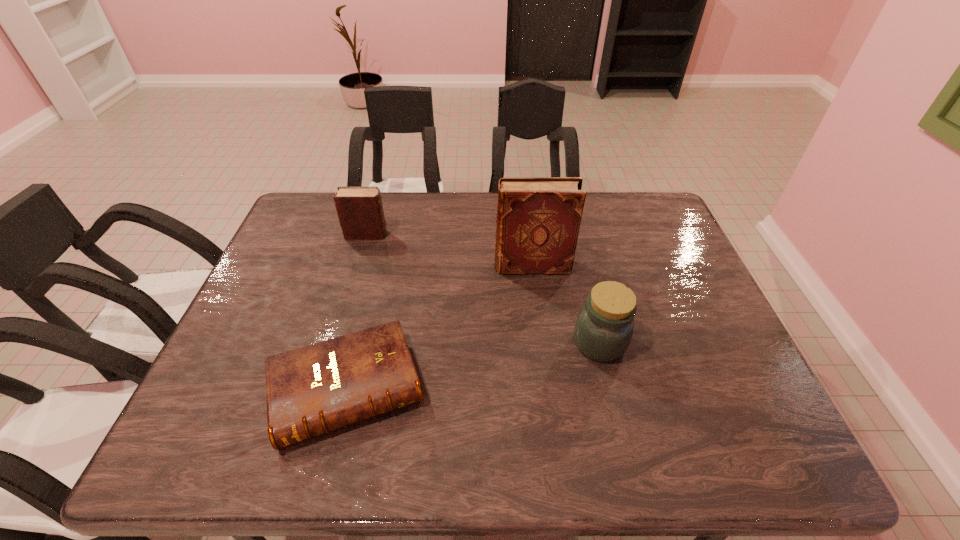
At what (x,y) coordinates should I click in order to perform the action: click on free space between the farthest object and the tallest object. Please return your answer as a coordinate pair (x, y). Looking at the image, I should click on (449, 251).

Find the location of `vacant space in between the jar and the shorter hardback book`. vacant space in between the jar and the shorter hardback book is located at coordinates (473, 366).

The image size is (960, 540). What are the coordinates of `object that stands as the third closest to the diary` in the screenshot? It's located at (604, 327).

Select which object is the closest to the shorter hardback book. Please provide its 2D coordinates. Your answer should be formatted as a tuple, i.e. [(x, y)], where the tuple contains the x and y coordinates of a point satisfying the conditions above.

[(538, 219)]

Where is `vacant area in the image that satisfies the following two spatial constraints: 1. on the back side of the left hardback book; 2. on the spine side of the diary`? The width and height of the screenshot is (960, 540). vacant area in the image that satisfies the following two spatial constraints: 1. on the back side of the left hardback book; 2. on the spine side of the diary is located at coordinates (385, 234).

Locate an element on the screen. The image size is (960, 540). vacant area in the image that satisfies the following two spatial constraints: 1. on the spine side of the farther hardback book; 2. on the front side of the nearer hardback book is located at coordinates (547, 389).

The width and height of the screenshot is (960, 540). I want to click on blank space that satisfies the following two spatial constraints: 1. on the spine side of the shortest object; 2. on the left side of the farthest object, so click(x=322, y=389).

This screenshot has width=960, height=540. What are the coordinates of `vacant space that satisfies the following two spatial constraints: 1. on the spine side of the jar; 2. on the right side of the right hardback book` in the screenshot? It's located at (541, 343).

The image size is (960, 540). I want to click on blank area in the image that satisfies the following two spatial constraints: 1. on the spine side of the farthest object; 2. on the right side of the shorter hardback book, so click(322, 389).

In order to click on vacant space that satisfies the following two spatial constraints: 1. on the spine side of the left hardback book; 2. on the right side of the diary in this screenshot , I will do `click(322, 389)`.